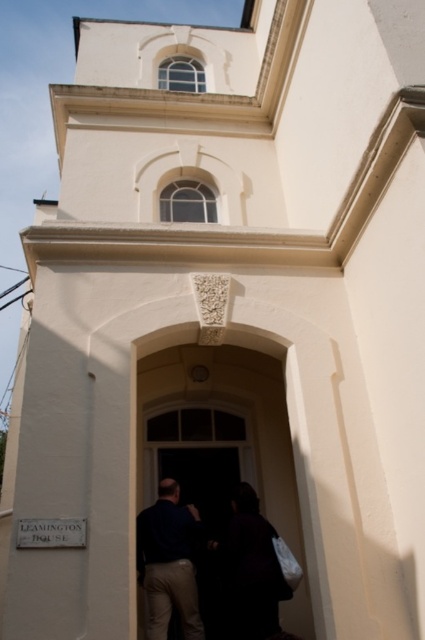
Question: Does dark brown wooden door at center have a smaller size compared to dark blue shirt at center?

Choices:
 (A) no
 (B) yes

Answer: (A)

Question: Which point is farther to the camera?

Choices:
 (A) (155, 600)
 (B) (272, 486)
 (C) (187, 595)

Answer: (B)

Question: Which of the following is the farthest from the observer?

Choices:
 (A) (237, 540)
 (B) (257, 412)
 (C) (192, 604)

Answer: (B)

Question: Is dark brown wooden door at center positioned at the back of dark fabric couple at center?

Choices:
 (A) no
 (B) yes

Answer: (A)

Question: Among these objects, which one is farthest from the camera?

Choices:
 (A) dark fabric couple at center
 (B) dark blue shirt at center
 (C) dark brown wooden door at center

Answer: (A)

Question: Does dark brown wooden door at center appear under dark blue shirt at center?

Choices:
 (A) yes
 (B) no

Answer: (B)